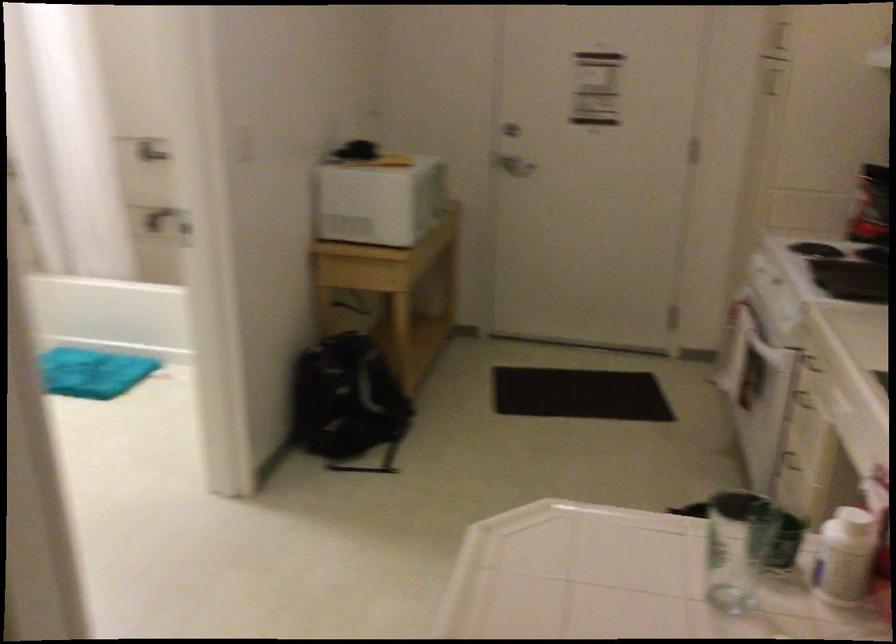
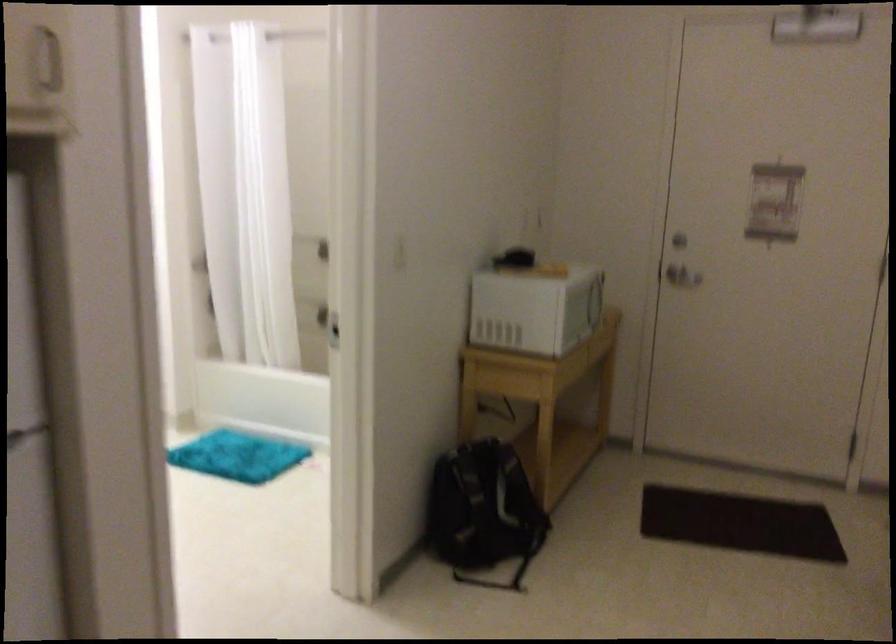
The point at (512, 151) is marked in the first image. Where is the corresponding point in the second image?

(679, 265)